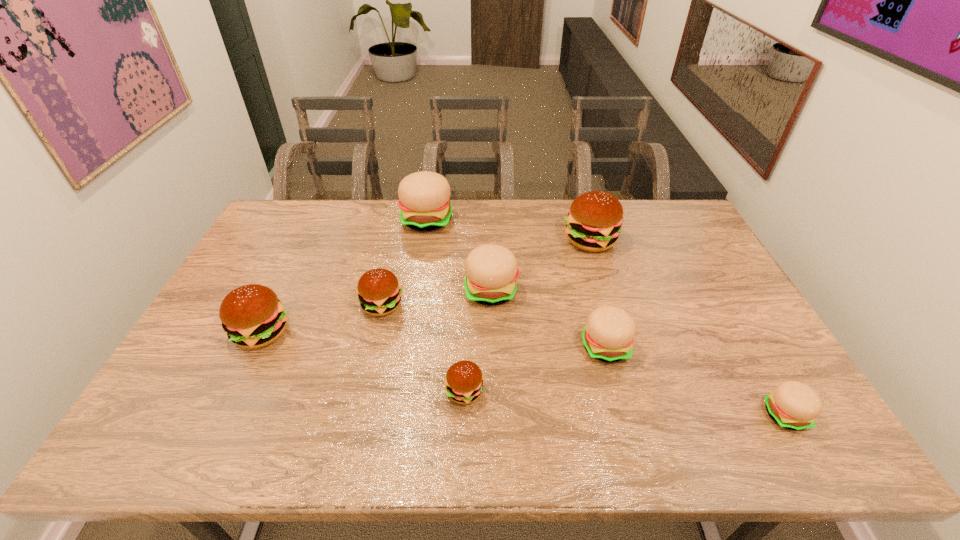
At what (x,y) coordinates should I click in order to perform the action: click on the rightmost brown hamburger. Please return your answer as a coordinate pair (x, y). This screenshot has width=960, height=540. Looking at the image, I should click on pyautogui.click(x=594, y=221).

Identify the location of the biggest brown hamburger. (594, 221).

Identify the location of the biggest beige hamburger. Image resolution: width=960 pixels, height=540 pixels. (424, 203).

You are a GUI agent. You are given a task and a screenshot of the screen. Output one action in this format:
    pyautogui.click(x=<x>, y=<y>)
    Task: Click on the leftmost beige hamburger
    This screenshot has height=540, width=960.
    Given the screenshot: What is the action you would take?
    pyautogui.click(x=424, y=203)

You are a GUI agent. You are given a task and a screenshot of the screen. Output one action in this format:
    pyautogui.click(x=<x>, y=<y>)
    Task: Click on the leftmost object
    The image size is (960, 540).
    Given the screenshot: What is the action you would take?
    pyautogui.click(x=252, y=315)

The width and height of the screenshot is (960, 540). I want to click on the leftmost brown hamburger, so [252, 315].

The width and height of the screenshot is (960, 540). I want to click on the third beige hamburger from right to left, so [x=491, y=270].

At what (x,y) coordinates should I click in order to perform the action: click on the third nearest beige hamburger. Please return your answer as a coordinate pair (x, y). This screenshot has height=540, width=960. Looking at the image, I should click on (491, 270).

This screenshot has width=960, height=540. What are the coordinates of `the third brown hamburger from right to left` in the screenshot? It's located at (x=379, y=292).

Where is `the second beige hamburger from right to left`? The height and width of the screenshot is (540, 960). the second beige hamburger from right to left is located at coordinates (608, 336).